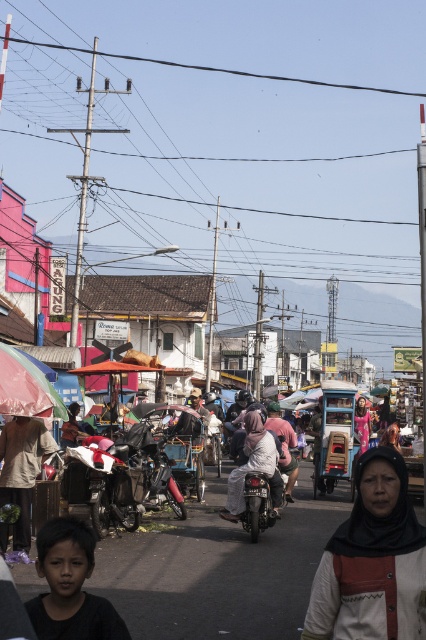
Which is in front, point (77, 541) or point (227, 492)?

Point (77, 541) is more forward.

Does black matte boy at lower left appear over matte pink hijab at center?

Correct, black matte boy at lower left is located above matte pink hijab at center.

Is point (98, 604) positioned in front of point (258, 429)?

Yes, point (98, 604) is closer to viewer.

Where is `black matte boy at lower left`? black matte boy at lower left is located at coordinates (69, 586).

How far apart are rainbow fabric umbrella at left and matte pink hijab at center?

10.62 feet

Does rainbow fabric umbrella at left appear over matte pink hijab at center?

Indeed, rainbow fabric umbrella at left is positioned over matte pink hijab at center.

Where is `rainbow fabric umbrella at left`? rainbow fabric umbrella at left is located at coordinates (25, 387).

Is white fabric headscarf at center thinner than brown fabric headscarf at lower left?

Indeed, white fabric headscarf at center has a lesser width compared to brown fabric headscarf at lower left.

Does white fabric headscarf at center have a greater width compared to brown fabric headscarf at lower left?

In fact, white fabric headscarf at center might be narrower than brown fabric headscarf at lower left.

Is point (351, 566) farther from viewer compared to point (37, 422)?

No, it is in front of (37, 422).

Identify the location of white fabric headscarf at center. This screenshot has height=640, width=426. (371, 561).